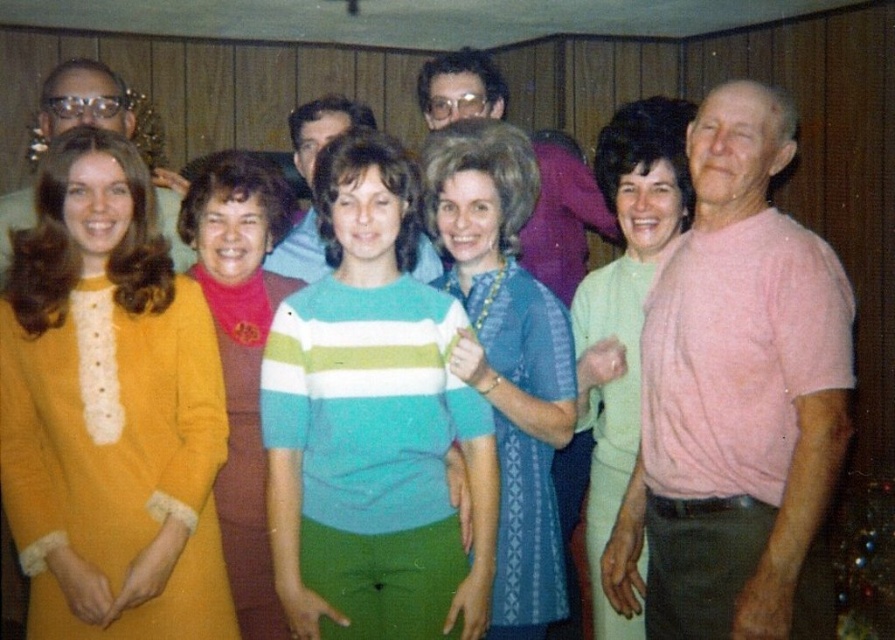
Looking at the group photo, you notice a light green sweater at center and a matte black glasses at upper left. Which object is positioned more to the right side of the image?

The light green sweater at center is positioned to the right of the matte black glasses at upper left, so it is more to the right side of the image.

You are organizing a clothing donation drive and need to categorize the shirts based on their size. The pink cotton shirt at right and the matte blue shirt at center are both available. Which shirt should you place in the large size bin?

The pink cotton shirt at right should be placed in the large size bin because it is larger in size than the matte blue shirt at center.